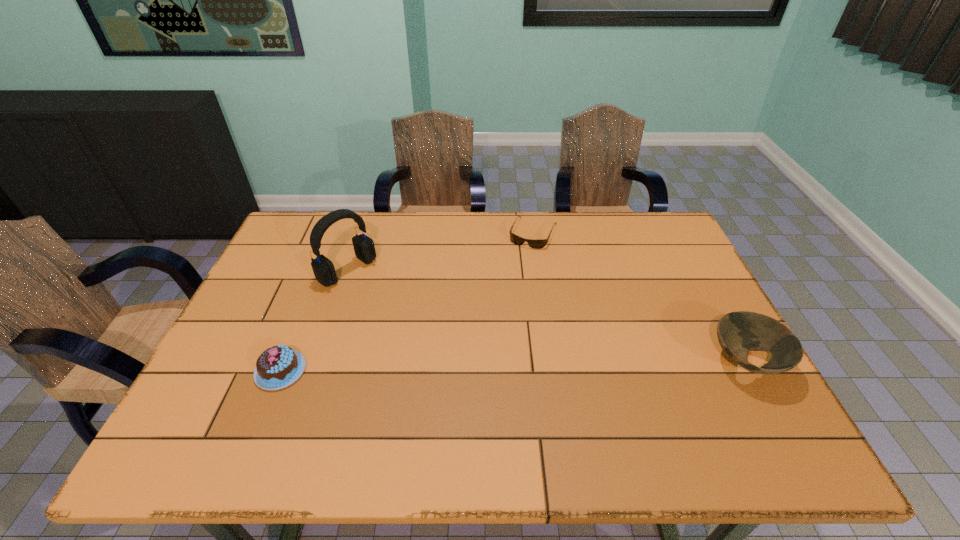
Where is `chocolate cake`? chocolate cake is located at coordinates (277, 367).

In order to click on bowl in this screenshot , I will do `click(739, 332)`.

Find the location of a particular element. This screenshot has width=960, height=540. the second tallest object is located at coordinates (739, 332).

Locate an element on the screen. The width and height of the screenshot is (960, 540). the farthest object is located at coordinates (533, 243).

At what (x,y) coordinates should I click in order to perform the action: click on sunglasses. Please return your answer as a coordinate pair (x, y). The height and width of the screenshot is (540, 960). Looking at the image, I should click on [533, 243].

You are a GUI agent. You are given a task and a screenshot of the screen. Output one action in this format:
    pyautogui.click(x=<x>, y=<y>)
    Task: Click on the third nearest object
    The image size is (960, 540).
    Given the screenshot: What is the action you would take?
    click(324, 271)

At what (x,y) coordinates should I click in order to perform the action: click on headset. Please return your answer as a coordinate pair (x, y). Looking at the image, I should click on (324, 271).

I want to click on free spot located on the back of the chocolate cake, so 310,298.

What are the coordinates of `vacant region located on the left of the third shortest object` in the screenshot? It's located at (623, 362).

Locate an element on the screen. The width and height of the screenshot is (960, 540). free region located on the front-facing side of the sunglasses is located at coordinates (492, 325).